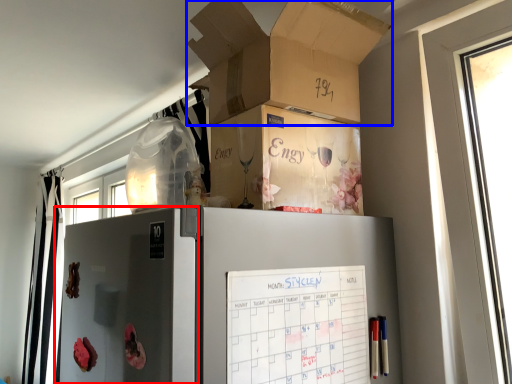
Question: Which point is closer to the camera, screen door (highlighted by a red box) or box (highlighted by a blue box)?

Choices:
 (A) screen door
 (B) box

Answer: (A)